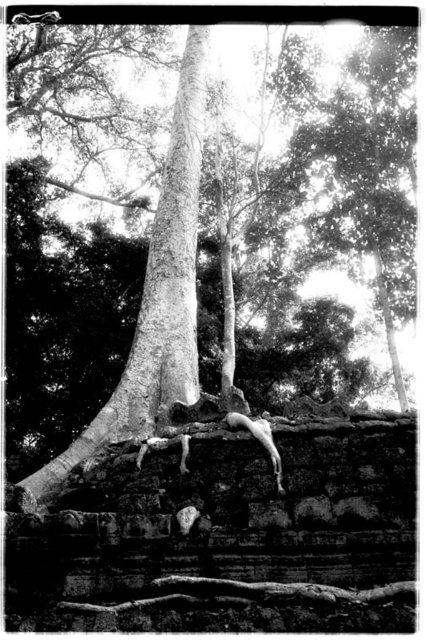
Is smooth bark tree at center thinner than smooth bark tree trunk at center?

No.

Is smooth bark tree at center positioned in front of smooth bark tree trunk at center?

That is True.

Which is in front, point (175, 369) or point (142, 333)?

Point (175, 369) is in front.

Find the location of a particular element. The width and height of the screenshot is (429, 640). smooth bark tree at center is located at coordinates (157, 292).